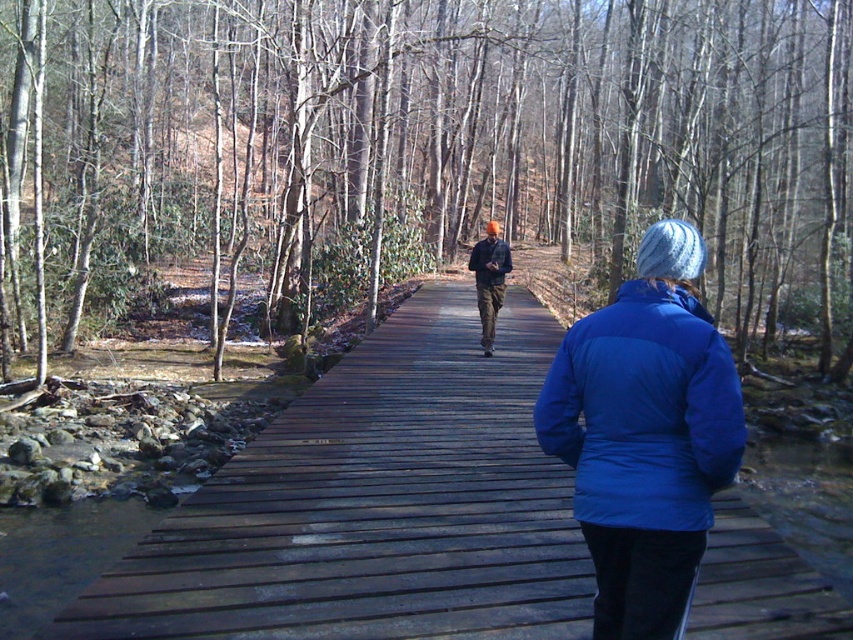
Between dark brown wooden bridge at center and dark blue jacket at center, which one has less height?

dark blue jacket at center is shorter.

Does point (523, 522) come behind point (505, 259)?

No, it is in front of (505, 259).

Between point (186, 632) and point (494, 260), which one is positioned behind?

The point (494, 260) is more distant.

Locate an element on the screen. dark brown wooden bridge at center is located at coordinates (374, 506).

Which of these two, dark brown wooden bridge at center or blue down jacket at center, stands taller?

Standing taller between the two is dark brown wooden bridge at center.

Which is behind, point (476, 499) or point (685, 352)?

Point (476, 499)

Is point (346, 387) positioned after point (663, 465)?

Yes, it is.

Locate an element on the screen. Image resolution: width=853 pixels, height=640 pixels. dark brown wooden bridge at center is located at coordinates (374, 506).

Can you confirm if blue down jacket at center is positioned to the right of orange plaid shirt at center?

Incorrect, blue down jacket at center is not on the right side of orange plaid shirt at center.

Who is more distant from viewer, (x=651, y=304) or (x=491, y=250)?

Positioned behind is point (x=491, y=250).

Where is `blue down jacket at center`? Image resolution: width=853 pixels, height=640 pixels. blue down jacket at center is located at coordinates (643, 410).